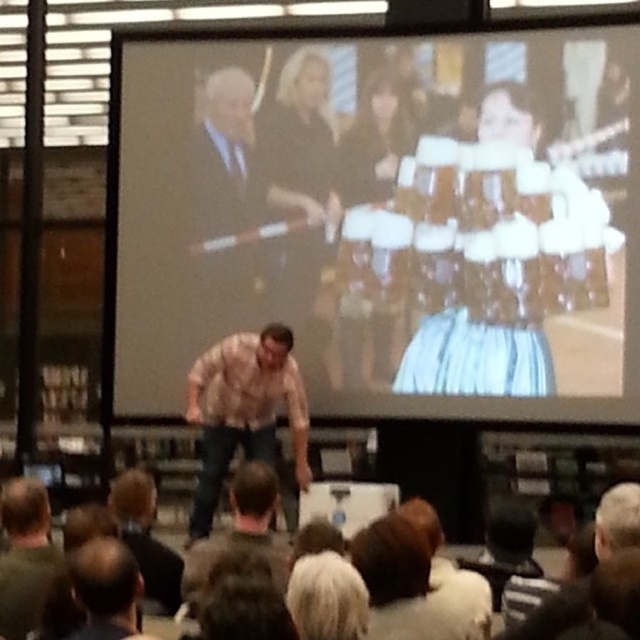
Which of these two, white wool sweater at lower center or dark brown hair at lower center, stands shorter?

dark brown hair at lower center is shorter.

Is white wool sweater at lower center thinner than dark brown hair at lower center?

In fact, white wool sweater at lower center might be wider than dark brown hair at lower center.

Is point (376, 532) more distant than point (548, 634)?

Yes, point (376, 532) is behind point (548, 634).

Locate an element on the screen. white wool sweater at lower center is located at coordinates (401, 582).

Between white matte projection screen at upper center and white wool sweater at lower center, which one appears on the left side from the viewer's perspective?

white matte projection screen at upper center is more to the left.

In the scene shown: Between white matte projection screen at upper center and white wool sweater at lower center, which one is positioned lower?

white wool sweater at lower center

You are a GUI agent. You are given a task and a screenshot of the screen. Output one action in this format:
    pyautogui.click(x=<x>, y=<y>)
    Task: Click on the white matte projection screen at upper center
    This screenshot has width=640, height=640.
    Given the screenshot: What is the action you would take?
    pyautogui.click(x=387, y=218)

Is point (212, 380) positioned after point (636, 516)?

Yes, it is.

Can you confirm if plaid shirt at center is smaller than dark brown hair at lower center?

No.

This screenshot has width=640, height=640. I want to click on plaid shirt at center, so click(243, 410).